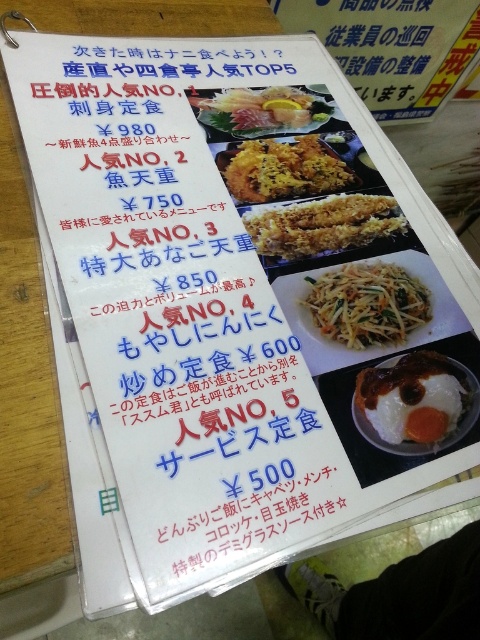
Question: Does yellowish matte noodles at center come in front of golden crispy fried chicken at center?

Choices:
 (A) no
 (B) yes

Answer: (B)

Question: Which of the following is the closest to the observer?

Choices:
 (A) (313, 168)
 (B) (253, 115)

Answer: (A)

Question: Among these points, which one is farthest from the camera?

Choices:
 (A) (282, 145)
 (B) (348, 308)
 (C) (238, 112)
 (D) (338, 250)

Answer: (C)

Question: Does white glossy fried egg at center have a larger size compared to yellowish matte noodles at center?

Choices:
 (A) yes
 (B) no

Answer: (B)

Question: Is golden crispy fried at center bigger than shiny silver sashimi at upper center?

Choices:
 (A) yes
 (B) no

Answer: (B)

Question: Which object is closer to the camera taking this photo?

Choices:
 (A) golden crispy fried chicken at center
 (B) yellowish matte noodles at center
 (C) golden crispy fried at center

Answer: (B)